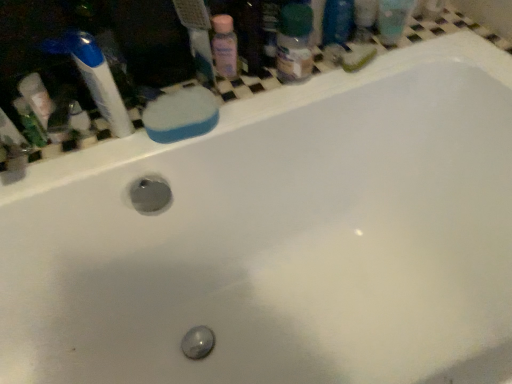
Question: Is blue sponge at upper left far away from blue plastic toothbrush at upper left?

Choices:
 (A) yes
 (B) no

Answer: (B)

Question: Is blue sponge at upper left at the left side of blue plastic toothbrush at upper left?

Choices:
 (A) yes
 (B) no

Answer: (B)

Question: Is blue sponge at upper left behind blue plastic toothbrush at upper left?

Choices:
 (A) yes
 (B) no

Answer: (A)

Question: From a real-world perspective, is blue sponge at upper left over blue plastic toothbrush at upper left?

Choices:
 (A) yes
 (B) no

Answer: (B)

Question: From the image's perspective, is blue sponge at upper left on blue plastic toothbrush at upper left?

Choices:
 (A) yes
 (B) no

Answer: (B)

Question: Does point (109, 91) appear closer or farther from the camera than point (220, 41)?

Choices:
 (A) farther
 (B) closer

Answer: (B)

Question: Considering the relative positions of blue plastic toothbrush at upper left and pink plastic bottle at upper center in the image provided, is blue plastic toothbrush at upper left to the left or to the right of pink plastic bottle at upper center?

Choices:
 (A) left
 (B) right

Answer: (A)

Question: In the image, is blue plastic toothbrush at upper left positioned in front of or behind pink plastic bottle at upper center?

Choices:
 (A) behind
 (B) front

Answer: (B)

Question: From a real-world perspective, is blue plastic toothbrush at upper left physically located above or below pink plastic bottle at upper center?

Choices:
 (A) below
 (B) above

Answer: (B)

Question: Considering the relative positions of translucent plastic bottle at upper right and pink plastic bottle at upper center in the image provided, is translucent plastic bottle at upper right to the left or to the right of pink plastic bottle at upper center?

Choices:
 (A) right
 (B) left

Answer: (A)

Question: From a real-world perspective, is translucent plastic bottle at upper right physically located above or below pink plastic bottle at upper center?

Choices:
 (A) above
 (B) below

Answer: (B)

Question: Considering the positions of translucent plastic bottle at upper right and pink plastic bottle at upper center in the image, is translucent plastic bottle at upper right bigger or smaller than pink plastic bottle at upper center?

Choices:
 (A) big
 (B) small

Answer: (A)

Question: From the image's perspective, relative to pink plastic bottle at upper center, is translucent plastic bottle at upper right above or below?

Choices:
 (A) below
 (B) above

Answer: (A)

Question: From a real-world perspective, relative to pink plastic bottle at upper center, is blue sponge at upper left vertically above or below?

Choices:
 (A) below
 (B) above

Answer: (A)

Question: Do you think blue sponge at upper left is within pink plastic bottle at upper center, or outside of it?

Choices:
 (A) outside
 (B) inside

Answer: (A)